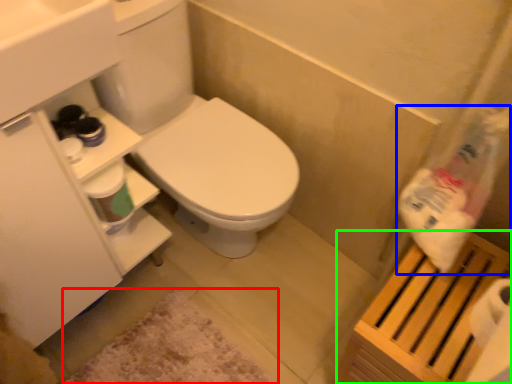
Question: Which object is positioned farthest from bath mat (highlighted by a red box)? Select from cleaning product (highlighted by a blue box) and shelf (highlighted by a green box).

Choices:
 (A) cleaning product
 (B) shelf

Answer: (A)